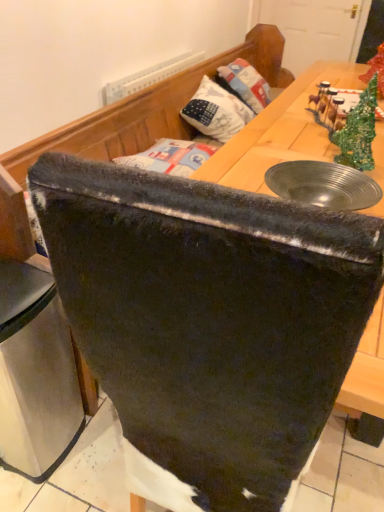
Question: Considering the positions of velvet black chair at center and white fabric pillow at upper center in the image, is velvet black chair at center wider or thinner than white fabric pillow at upper center?

Choices:
 (A) thin
 (B) wide

Answer: (B)

Question: Is velvet black chair at center bigger or smaller than white fabric pillow at upper center?

Choices:
 (A) small
 (B) big

Answer: (B)

Question: Considering the real-world distances, which object is farthest from the velvet black chair at center?

Choices:
 (A) velvet black chair at center
 (B) white fabric pillow at upper center
 (C) stainless steel trash can at lower left

Answer: (B)

Question: Which object is positioned closest to the stainless steel trash can at lower left?

Choices:
 (A) white fabric pillow at upper center
 (B) velvet black chair at center
 (C) velvet black chair at center

Answer: (C)